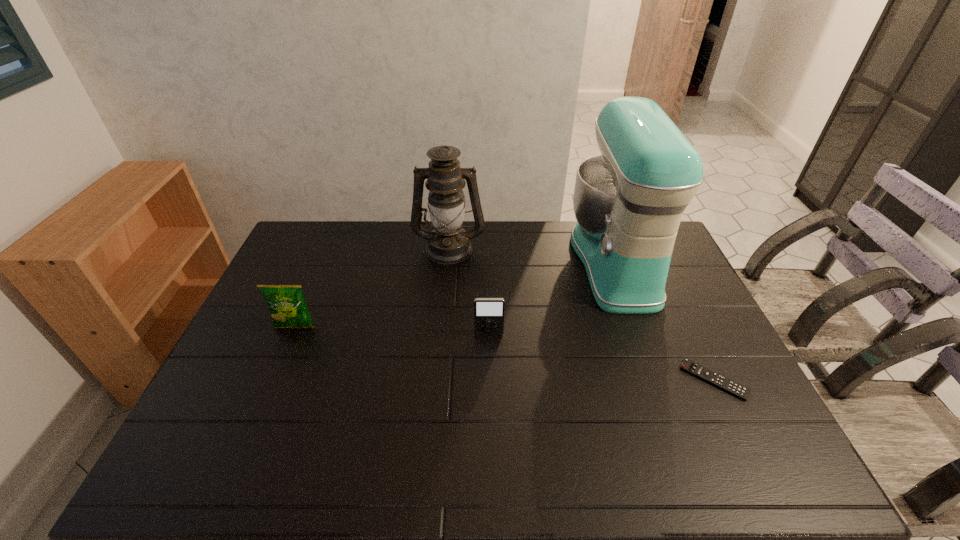
You are a GUI agent. You are given a task and a screenshot of the screen. Output one action in this format:
    pyautogui.click(x=<x>, y=<y>)
    Task: Click on the vacant region at the far edge of the desktop
    
    Given the screenshot: What is the action you would take?
    pyautogui.click(x=482, y=248)

The width and height of the screenshot is (960, 540). Find the location of `free location at the near edge`. free location at the near edge is located at coordinates (301, 469).

Locate an element on the screen. This screenshot has height=540, width=960. vacant area at the left edge of the desktop is located at coordinates (216, 408).

At what (x,y) coordinates should I click in order to perform the action: click on vacant region between the mixer and the nearest object. Please return your answer as a coordinate pair (x, y). Looking at the image, I should click on (664, 321).

Locate an element on the screen. The image size is (960, 540). vacant area that lies between the mixer and the second tallest object is located at coordinates (532, 255).

Find the location of a particular element. The height and width of the screenshot is (540, 960). free spot between the oil lamp and the tallest object is located at coordinates (532, 255).

At what (x,y) coordinates should I click in order to perform the action: click on vacant area between the tallest object and the third tallest object. Please return your answer as a coordinate pair (x, y). The image size is (960, 540). Looking at the image, I should click on (455, 295).

Locate an element on the screen. free point between the remote control and the third tallest object is located at coordinates (505, 353).

What are the coordinates of `free space between the iPod and the leftmost object` in the screenshot? It's located at (392, 330).

The height and width of the screenshot is (540, 960). Identify the location of vacant area that lies between the remote control and the iPod. (601, 357).